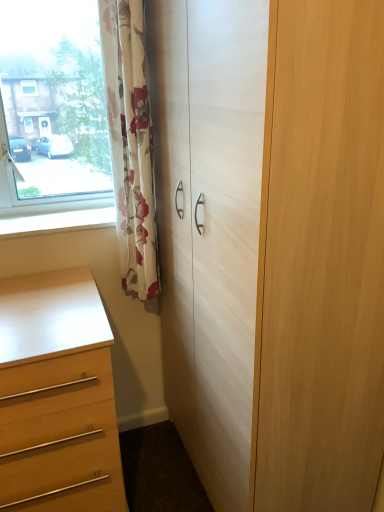
Question: From a real-world perspective, does matte wood chest of drawers at lower left stand above white glossy window sill at lower left?

Choices:
 (A) yes
 (B) no

Answer: (B)

Question: Is matte wood chest of drawers at lower left at the left side of white glossy window sill at lower left?

Choices:
 (A) yes
 (B) no

Answer: (A)

Question: Can you confirm if matte wood chest of drawers at lower left is shorter than white glossy window sill at lower left?

Choices:
 (A) no
 (B) yes

Answer: (A)

Question: Considering the relative sizes of matte wood chest of drawers at lower left and white glossy window sill at lower left in the image provided, is matte wood chest of drawers at lower left bigger than white glossy window sill at lower left?

Choices:
 (A) no
 (B) yes

Answer: (B)

Question: Is matte wood chest of drawers at lower left completely or partially outside of white glossy window sill at lower left?

Choices:
 (A) no
 (B) yes

Answer: (B)

Question: Is matte wood chest of drawers at lower left closer to the viewer compared to white glossy window sill at lower left?

Choices:
 (A) yes
 (B) no

Answer: (A)

Question: From a real-world perspective, is floral fabric curtain at left physically above white glossy window sill at lower left?

Choices:
 (A) yes
 (B) no

Answer: (A)

Question: Does floral fabric curtain at left come in front of white glossy window sill at lower left?

Choices:
 (A) no
 (B) yes

Answer: (B)

Question: Is floral fabric curtain at left far away from white glossy window sill at lower left?

Choices:
 (A) yes
 (B) no

Answer: (B)

Question: Does floral fabric curtain at left appear on the left side of white glossy window sill at lower left?

Choices:
 (A) no
 (B) yes

Answer: (A)

Question: Can you confirm if floral fabric curtain at left is shorter than white glossy window sill at lower left?

Choices:
 (A) no
 (B) yes

Answer: (A)

Question: Can you confirm if floral fabric curtain at left is bigger than white glossy window sill at lower left?

Choices:
 (A) yes
 (B) no

Answer: (A)

Question: Is white wood cupboard at center wider than floral fabric curtain at left?

Choices:
 (A) no
 (B) yes

Answer: (B)